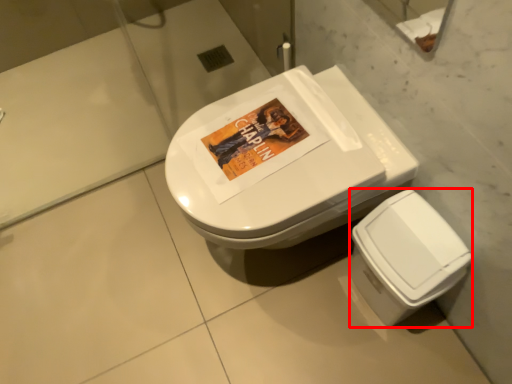
Question: From the image's perspective, where is bidet (annotated by the red box) located relative to toilet?

Choices:
 (A) above
 (B) below

Answer: (B)